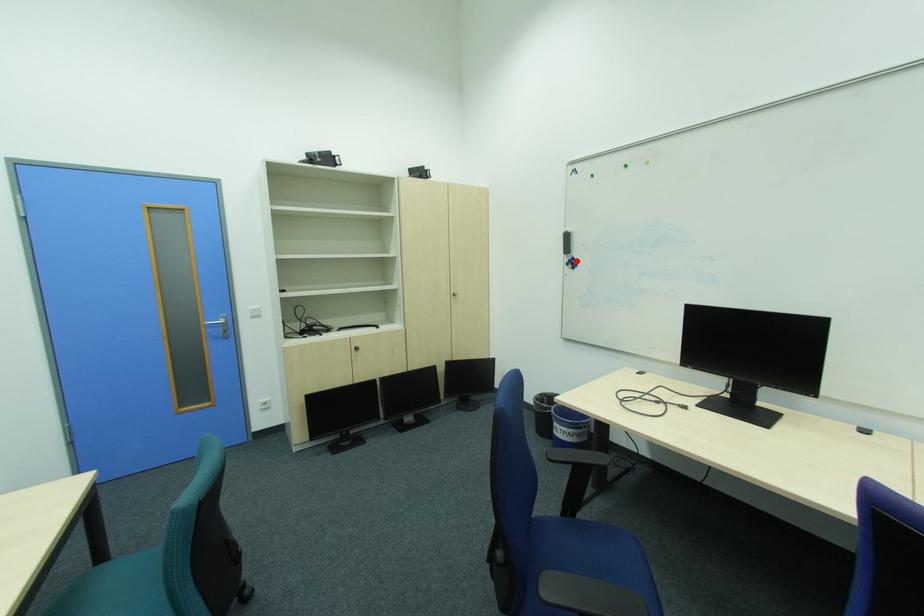
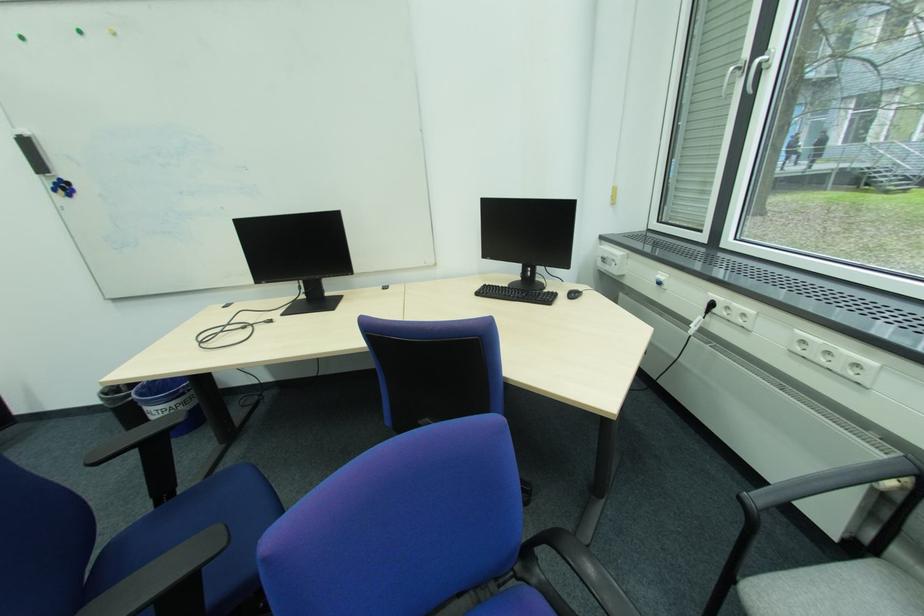
In the second image, find the point that corresponds to the highlighted location in the first image.

(62, 185)